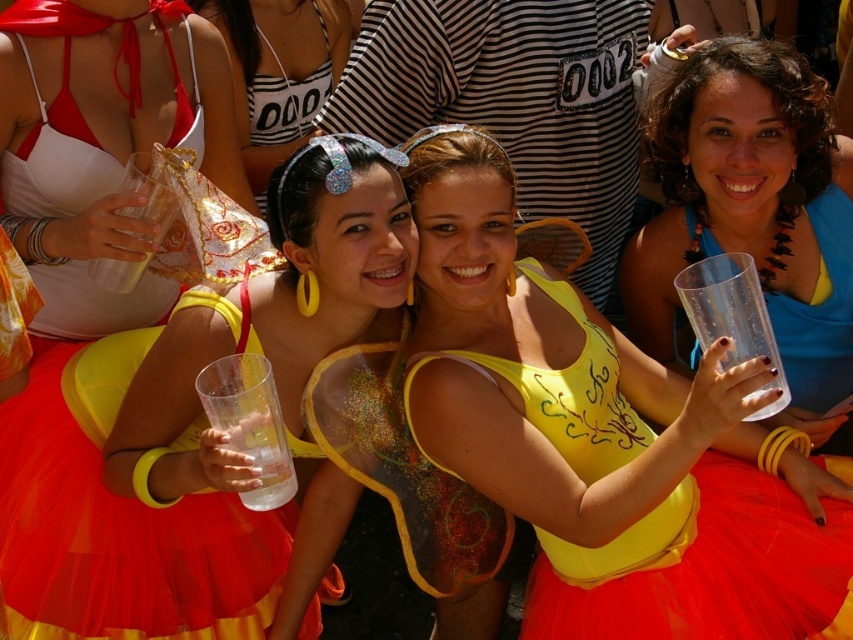
Question: Does matte yellow tulle dress at center have a lesser width compared to transparent plastic cup at upper right?

Choices:
 (A) yes
 (B) no

Answer: (B)

Question: Which is farther from the matte yellow tulle dress at center?

Choices:
 (A) white satin bikini top at upper left
 (B) transparent plastic cup at right

Answer: (B)

Question: Is matte yellow tulle dress at center thinner than transparent plastic cup at right?

Choices:
 (A) no
 (B) yes

Answer: (A)

Question: Which object appears farthest from the camera in this image?

Choices:
 (A) white satin bikini top at upper left
 (B) matte yellow tulle dress at center
 (C) transparent plastic cup at right
 (D) matte plastic cup at upper center

Answer: (D)

Question: Can you confirm if translucent plastic cup at center is smaller than transparent plastic cup at upper right?

Choices:
 (A) yes
 (B) no

Answer: (B)

Question: Among these points, which one is nearest to the camera?

Choices:
 (A) (39, 474)
 (B) (549, 506)
 (C) (103, 83)
 (D) (279, 93)

Answer: (B)